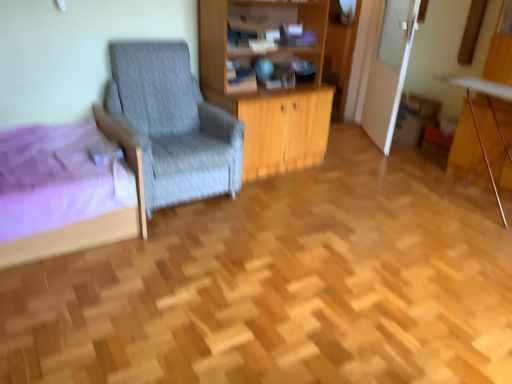
The height and width of the screenshot is (384, 512). Identify the location of vacant region to the left of wooden desk at right. (391, 193).